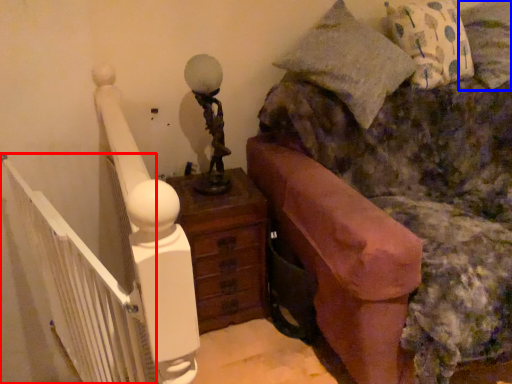
Question: Which object appears farthest to the camera in this image, balustrade (highlighted by a red box) or pillow (highlighted by a blue box)?

Choices:
 (A) balustrade
 (B) pillow

Answer: (B)